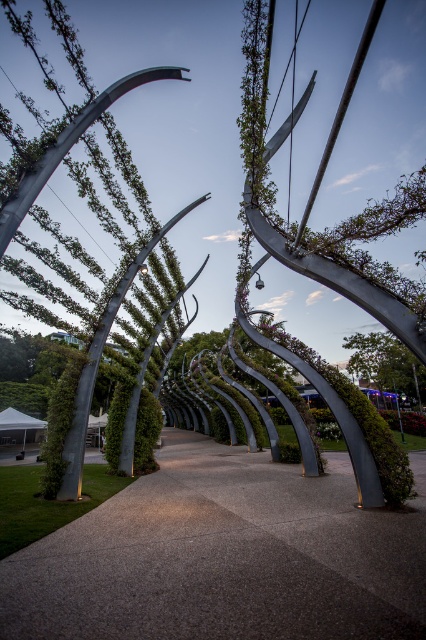
Question: Is green leafy arch at center to the left of green leafy tree at lower right from the viewer's perspective?

Choices:
 (A) yes
 (B) no

Answer: (A)

Question: Which of these objects is positioned closest to the green leafy tree at lower right?

Choices:
 (A) concrete textured pathway at center
 (B) green leafy arch at center

Answer: (A)

Question: Which object appears closest to the camera in this image?

Choices:
 (A) green leafy tree at lower right
 (B) concrete textured pathway at center
 (C) green leafy arch at center

Answer: (B)

Question: Is concrete textured pathway at center bigger than green leafy tree at lower right?

Choices:
 (A) no
 (B) yes

Answer: (B)

Question: Does concrete textured pathway at center have a greater width compared to green leafy tree at lower right?

Choices:
 (A) no
 (B) yes

Answer: (B)

Question: Among these points, which one is nearest to the camera?

Choices:
 (A) (78, 124)
 (B) (112, 612)
 (C) (373, 340)

Answer: (B)